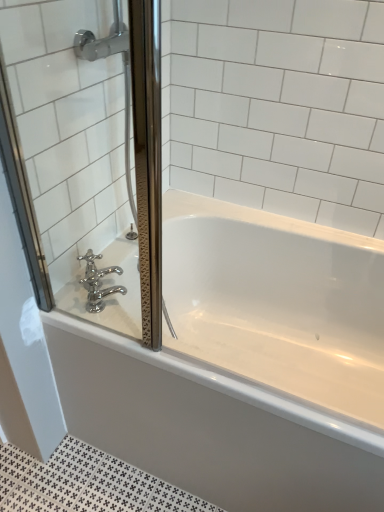
Where is `polished chrome faucet at lower left`? polished chrome faucet at lower left is located at coordinates (98, 282).

The image size is (384, 512). What do you see at coordinates (244, 364) in the screenshot? I see `white glossy bathtub at center` at bounding box center [244, 364].

This screenshot has width=384, height=512. Find the location of `polished chrome faucet at lower left`. polished chrome faucet at lower left is located at coordinates (98, 282).

Is polished chrome faucet at lower left looking in the opposite direction of white glossy bathtub at center?

No, white glossy bathtub at center is not at the back of polished chrome faucet at lower left.

From the image's perspective, which is below, polished chrome faucet at lower left or white glossy bathtub at center?

white glossy bathtub at center appears lower in the image.

Consider the image. Which of these two, polished chrome faucet at lower left or white glossy bathtub at center, is bigger?

With larger size is white glossy bathtub at center.

From the image's perspective, which one is positioned higher, clear glass screen door at left or polished chrome faucet at lower left?

clear glass screen door at left is shown above in the image.

Where is `tap on the left of clear glass screen door at left`? tap on the left of clear glass screen door at left is located at coordinates (98, 282).

Is clear glass screen door at left behind polished chrome faucet at lower left?

No, the depth of clear glass screen door at left is less than that of polished chrome faucet at lower left.

From the image's perspective, which is below, polished chrome faucet at lower left or clear glass screen door at left?

polished chrome faucet at lower left, from the image's perspective.

Considering the sizes of objects polished chrome faucet at lower left and clear glass screen door at left in the image provided, who is taller, polished chrome faucet at lower left or clear glass screen door at left?

Standing taller between the two is clear glass screen door at left.

Is polished chrome faucet at lower left positioned beyond the bounds of clear glass screen door at left?

No, polished chrome faucet at lower left is not outside of clear glass screen door at left.

Which of these two, polished chrome faucet at lower left or clear glass screen door at left, is bigger?

Bigger between the two is clear glass screen door at left.

Which object is positioned more to the left, white glossy bathtub at center or polished chrome faucet at lower left?

From the viewer's perspective, polished chrome faucet at lower left appears more on the left side.

Considering the sizes of objects white glossy bathtub at center and polished chrome faucet at lower left in the image provided, who is shorter, white glossy bathtub at center or polished chrome faucet at lower left?

polished chrome faucet at lower left is shorter.

Looking at their sizes, would you say white glossy bathtub at center is wider or thinner than polished chrome faucet at lower left?

Clearly, white glossy bathtub at center has more width compared to polished chrome faucet at lower left.

Is white glossy bathtub at center positioned with its back to polished chrome faucet at lower left?

No, white glossy bathtub at center is not facing the opposite direction of polished chrome faucet at lower left.

How different are the orientations of clear glass screen door at left and white glossy bathtub at center in degrees?

clear glass screen door at left and white glossy bathtub at center are facing 0.000218 degrees away from each other.

Based on their sizes in the image, would you say clear glass screen door at left is bigger or smaller than white glossy bathtub at center?

Clearly, clear glass screen door at left is smaller in size than white glossy bathtub at center.

Measure the distance from clear glass screen door at left to white glossy bathtub at center.

clear glass screen door at left and white glossy bathtub at center are 39.99 centimeters apart from each other.

Is white glossy bathtub at center at the back of clear glass screen door at left?

clear glass screen door at left does not have its back to white glossy bathtub at center.

Is white glossy bathtub at center turned away from clear glass screen door at left?

No, white glossy bathtub at center is not facing the opposite direction of clear glass screen door at left.

From the image's perspective, is white glossy bathtub at center beneath clear glass screen door at left?

Yes, from the image's perspective, white glossy bathtub at center is beneath clear glass screen door at left.

Between white glossy bathtub at center and clear glass screen door at left, which one has smaller size?

Smaller between the two is clear glass screen door at left.

Would you say white glossy bathtub at center is inside or outside clear glass screen door at left?

white glossy bathtub at center is not inside clear glass screen door at left, it's outside.

Locate an element on the screen. bathtub lying on the right of polished chrome faucet at lower left is located at coordinates (244, 364).

I want to click on screen door located above the polished chrome faucet at lower left (from the image's perspective), so click(86, 155).

Consider the image. Estimate the real-world distances between objects in this image. Which object is further from polished chrome faucet at lower left, white glossy bathtub at center or clear glass screen door at left?

white glossy bathtub at center is positioned further to the anchor polished chrome faucet at lower left.

Looking at the image, which one is located closer to white glossy bathtub at center, clear glass screen door at left or polished chrome faucet at lower left?

Based on the image, clear glass screen door at left appears to be nearer to white glossy bathtub at center.

Estimate the real-world distances between objects in this image. Which object is closer to polished chrome faucet at lower left, clear glass screen door at left or white glossy bathtub at center?

Among the two, clear glass screen door at left is located nearer to polished chrome faucet at lower left.

Looking at the image, which one is located closer to clear glass screen door at left, white glossy bathtub at center or polished chrome faucet at lower left?

The object closer to clear glass screen door at left is polished chrome faucet at lower left.

Estimate the real-world distances between objects in this image. Which object is closer to clear glass screen door at left, polished chrome faucet at lower left or white glossy bathtub at center?

polished chrome faucet at lower left is positioned closer to the anchor clear glass screen door at left.

Consider the image. When comparing their distances from white glossy bathtub at center, does polished chrome faucet at lower left or clear glass screen door at left seem closer?

clear glass screen door at left is closer to white glossy bathtub at center.

I want to click on bathtub between clear glass screen door at left and polished chrome faucet at lower left in the front-back direction, so click(x=244, y=364).